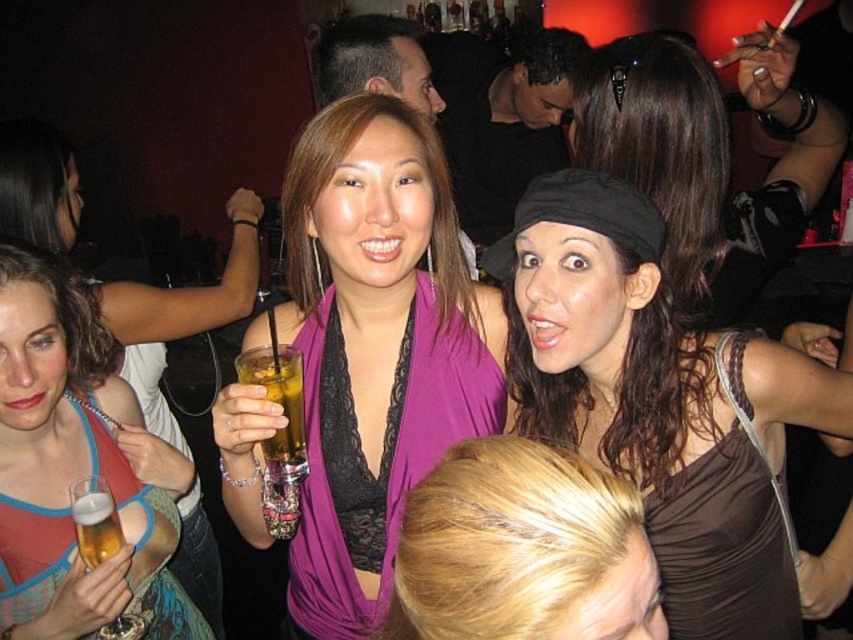
Question: Which object is positioned farthest from the blonde hair at center?

Choices:
 (A) brown satin dress at upper center
 (B) brown satin dress at center
 (C) translucent glass beer at lower left
 (D) shiny black hat at center

Answer: (D)

Question: Is purple satin scarf at center to the right of translucent glass beer at lower left from the viewer's perspective?

Choices:
 (A) no
 (B) yes

Answer: (B)

Question: Which of the following is the closest to the observer?

Choices:
 (A) brown satin dress at upper center
 (B) translucent glass beer at lower left

Answer: (A)

Question: Which object appears farthest from the camera in this image?

Choices:
 (A) translucent glass beer at lower left
 (B) shiny black hat at center

Answer: (B)

Question: Is brown satin dress at upper center below translucent glass beer at lower left?

Choices:
 (A) no
 (B) yes

Answer: (A)

Question: Can you confirm if matte blue tank top at lower left is wider than shiny black hat at center?

Choices:
 (A) yes
 (B) no

Answer: (B)